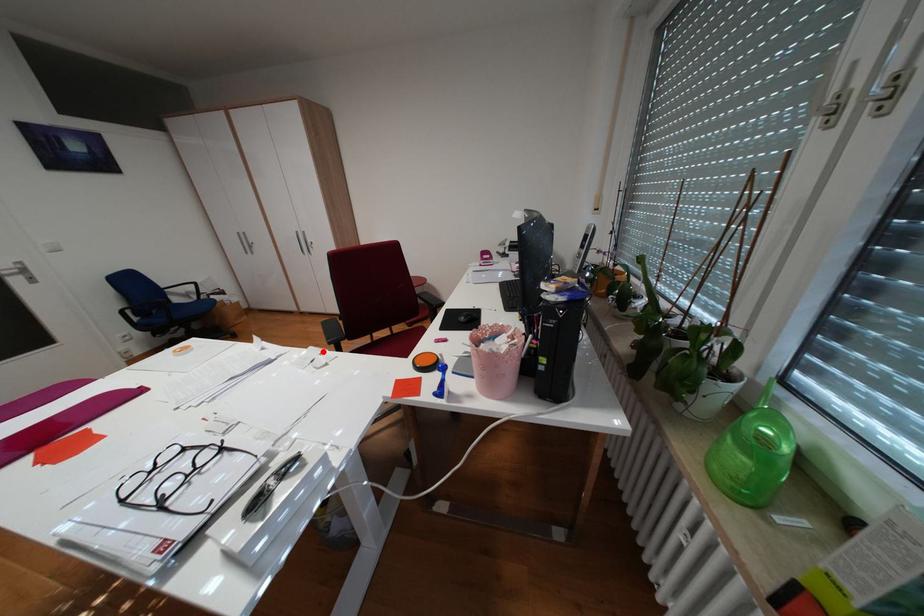
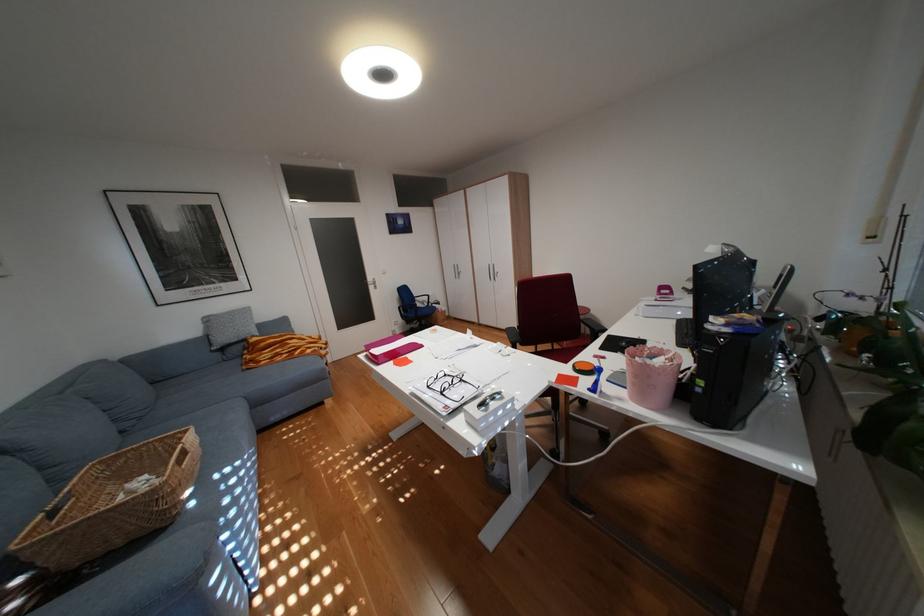
The point at the highlighted location is marked in the first image. Where is the corresponding point in the second image?

(512, 345)